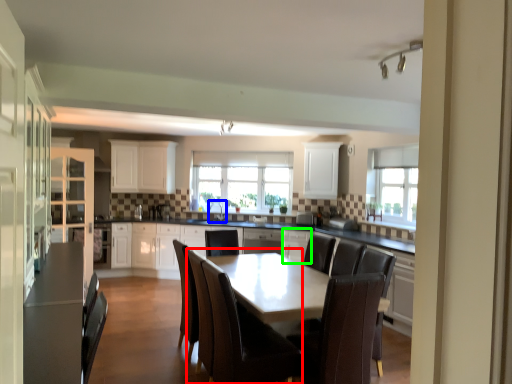
Question: Based on their relative distances, which object is nearer to chair (highlighted by a red box)? Choose from sink (highlighted by a blue box) and cabinetry (highlighted by a green box).

Choices:
 (A) sink
 (B) cabinetry

Answer: (B)